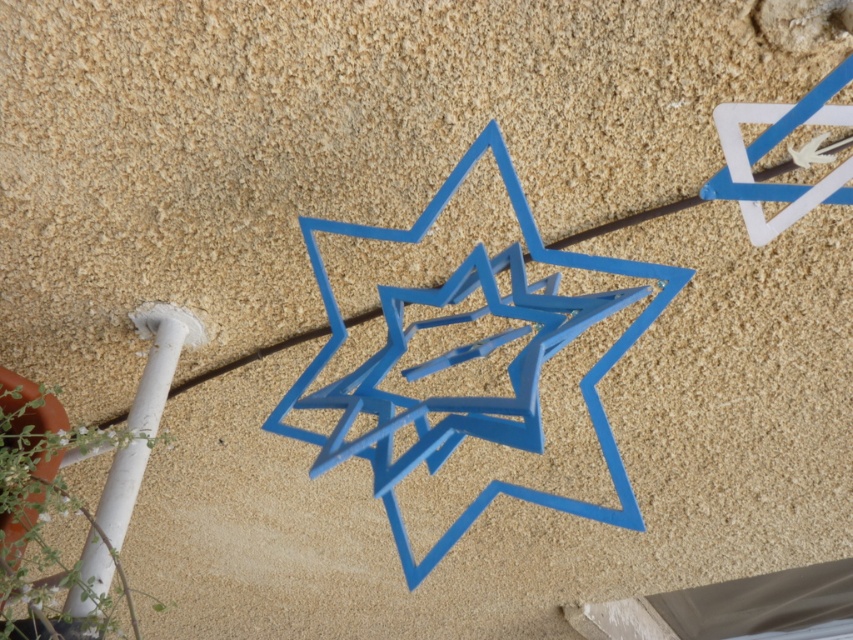
Question: Which object is the farthest from the white matte pole at lower left?

Choices:
 (A) blue matte star at upper right
 (B) blue matte star at center

Answer: (A)

Question: Among these points, which one is nearest to the camera?

Choices:
 (A) (463, 413)
 (B) (807, 145)
 (C) (94, 556)

Answer: (A)

Question: Is white matte pole at lower left positioned behind blue matte star at upper right?

Choices:
 (A) no
 (B) yes

Answer: (A)

Question: Does white matte pole at lower left have a greater width compared to blue matte star at upper right?

Choices:
 (A) yes
 (B) no

Answer: (A)

Question: Where is blue matte star at center located in relation to blue matte star at upper right in the image?

Choices:
 (A) left
 (B) right

Answer: (A)

Question: Which of these objects is positioned closest to the white matte pole at lower left?

Choices:
 (A) blue matte star at upper right
 (B) blue matte star at center

Answer: (B)